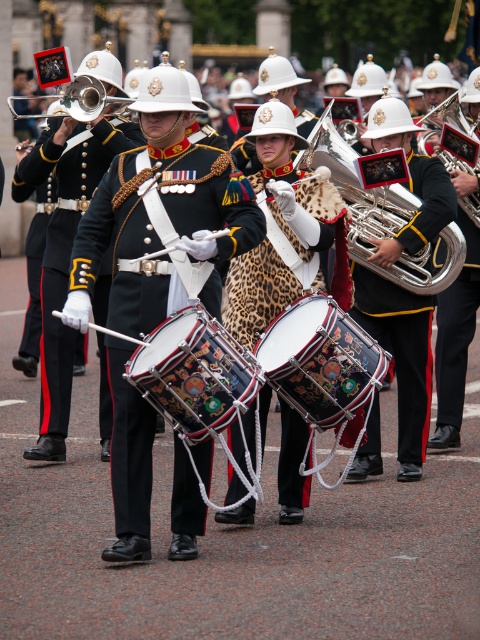
Is shiny silver tuba at center below shiny silver trumpet at center?

Correct, shiny silver tuba at center is located below shiny silver trumpet at center.

Does shiny silver tuba at center come in front of shiny silver trumpet at center?

Yes, shiny silver tuba at center is closer to the viewer.

This screenshot has height=640, width=480. What do you see at coordinates (400, 349) in the screenshot? I see `shiny silver tuba at center` at bounding box center [400, 349].

You are a GUI agent. You are given a task and a screenshot of the screen. Output one action in this format:
    pyautogui.click(x=<x>, y=<y>)
    Task: Click on the shiny silver tuba at center
    This screenshot has height=640, width=480.
    Given the screenshot: What is the action you would take?
    pyautogui.click(x=400, y=349)

Is point (331, 321) in front of point (228, 392)?

No, (331, 321) is behind (228, 392).

Is shiny metallic drum at center above decorative leather drum at center?

Correct, shiny metallic drum at center is located above decorative leather drum at center.

Does point (307, 314) lie in front of point (166, 417)?

No, (307, 314) is further to viewer.

This screenshot has height=640, width=480. In order to click on shiny metallic drum at center in this screenshot , I will do `click(321, 360)`.

Does shiny black drum at center have a larger size compared to leopard print fabric at center?

Correct, shiny black drum at center is larger in size than leopard print fabric at center.

Who is more forward, (90, 269) or (261, 388)?

Point (90, 269)

Where is `shiny black drum at center`? shiny black drum at center is located at coordinates (156, 227).